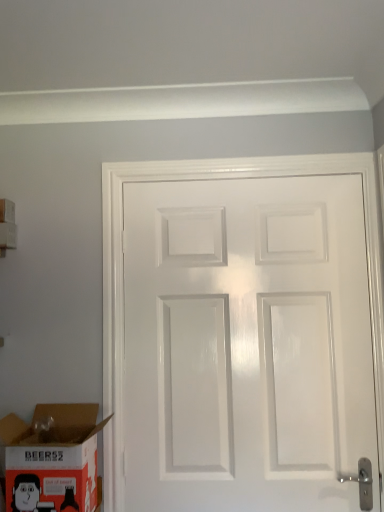
Question: In terms of width, does white glossy door at center look wider or thinner when compared to white cardboard box at upper left, marked as the first box in a top-to-bottom arrangement?

Choices:
 (A) thin
 (B) wide

Answer: (A)

Question: Relative to white cardboard box at upper left, the 2th box when ordered from bottom to top, is white glossy door at center in front or behind?

Choices:
 (A) front
 (B) behind

Answer: (A)

Question: Based on their relative distances, which object is nearer to the cardboard box at lower left, the 1th box when ordered from bottom to top?

Choices:
 (A) white glossy door at center
 (B) white cardboard box at upper left, marked as the first box in a top-to-bottom arrangement

Answer: (A)

Question: Which is nearer to the white glossy door at center?

Choices:
 (A) white cardboard box at upper left, positioned as the first box in left-to-right order
 (B) cardboard box at lower left, marked as the second box in a back-to-front arrangement

Answer: (B)